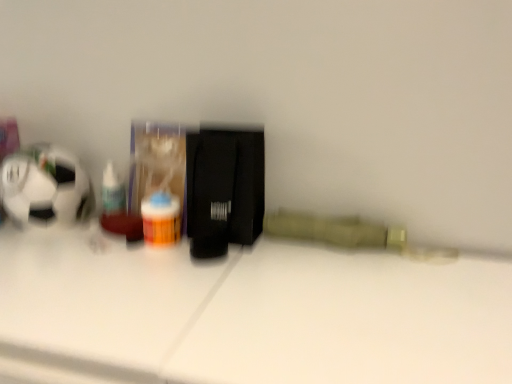
Locate an element on the screen. The height and width of the screenshot is (384, 512). free space to the left of translucent plastic pill bottle at center is located at coordinates (65, 248).